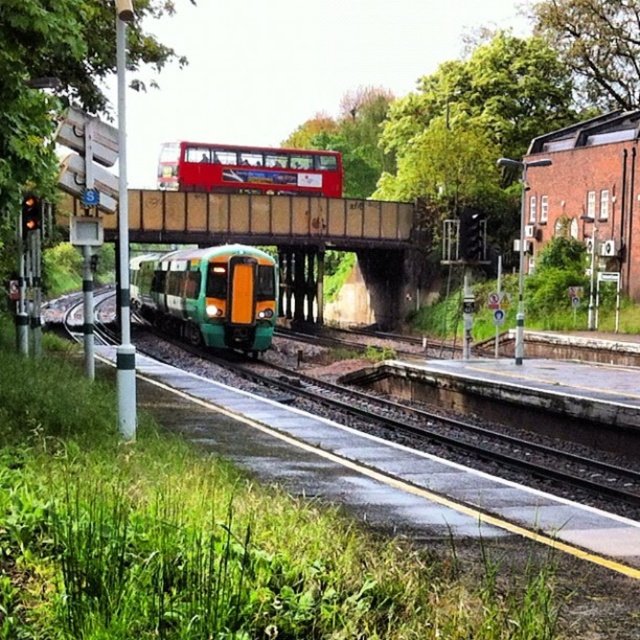
Looking at this image, between green matte train at center and red rubberized bus at upper center, which one is positioned higher?

red rubberized bus at upper center is higher up.

Which is behind, point (266, 260) or point (339, 161)?

The point (339, 161) is behind.

Locate an element on the screen. This screenshot has width=640, height=640. green matte train at center is located at coordinates (209, 294).